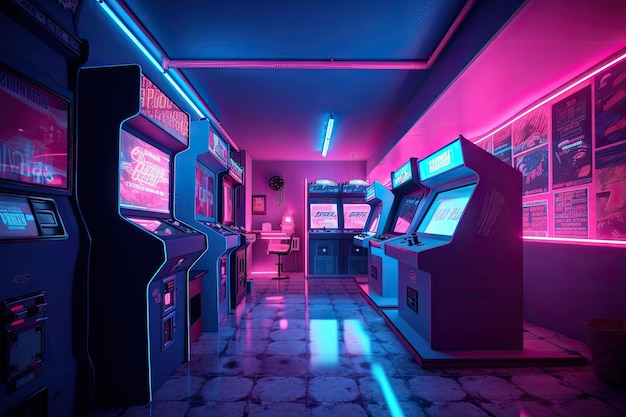
You are a GUI agent. You are given a task and a screenshot of the screen. Output one action in this format:
    pyautogui.click(x=<x>, y=<y>)
    Task: Click on the pink ceiling pipe
    This screenshot has height=417, width=626.
    Given the screenshot: What is the action you would take?
    pyautogui.click(x=310, y=65), pyautogui.click(x=446, y=40)